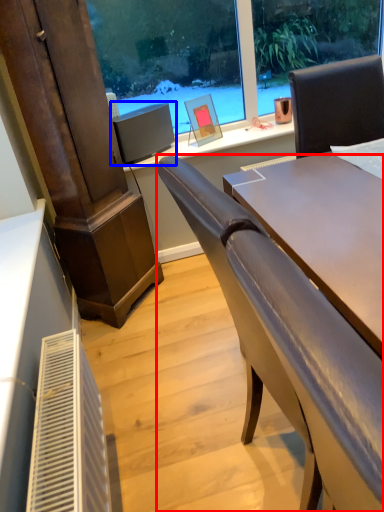
Question: Which object is further to the camera taking this photo, chair (highlighted by a red box) or computer monitor (highlighted by a blue box)?

Choices:
 (A) chair
 (B) computer monitor

Answer: (B)